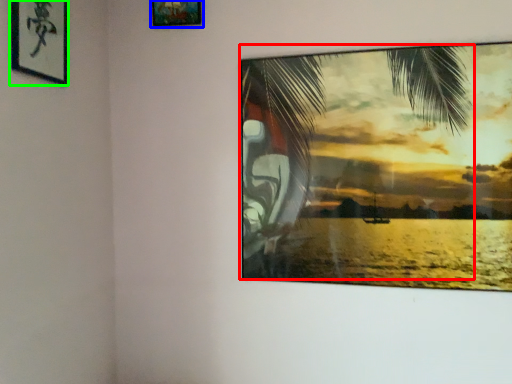
Question: Estimate the real-world distances between objects in this image. Which object is closer to palm tree (highlighted by a red box), picture frame (highlighted by a blue box) or picture frame (highlighted by a green box)?

Choices:
 (A) picture frame
 (B) picture frame

Answer: (A)